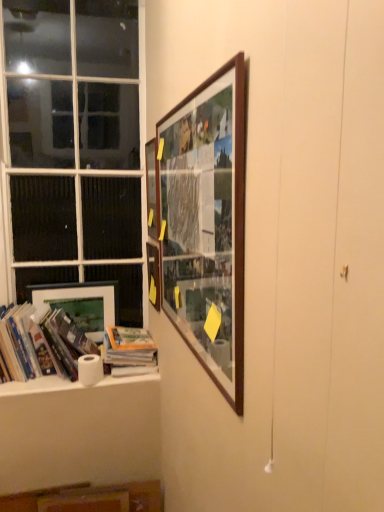
Question: In terms of width, does hardcover book at lower left, which ranks as the second book in left-to-right order, look wider or thinner when compared to hardcover books at left, placed as the first book when sorted from left to right?

Choices:
 (A) thin
 (B) wide

Answer: (B)

Question: Which is correct: hardcover book at lower left, which ranks as the second book in left-to-right order, is inside hardcover books at left, placed as the first book when sorted from left to right, or outside of it?

Choices:
 (A) outside
 (B) inside

Answer: (A)

Question: Based on their relative distances, which object is nearer to the white matte toilet paper at lower left?

Choices:
 (A) wooden picture frame at upper center, which is the 2th picture frame in back-to-front order
 (B) wooden picture frame at upper center, placed as the 1th picture frame when sorted from right to left
 (C) matte wooden picture frame at lower left, marked as the 1th picture frame in a left-to-right arrangement
 (D) wooden frame at upper center, which is the second picture frame from front to back
 (E) hardcover book at lower left, the 1th book positioned from the right

Answer: (E)

Question: Which object is the closest to the wooden picture frame at upper center, which is the 4th picture frame in back-to-front order?

Choices:
 (A) wooden picture frame at upper center, acting as the second picture frame starting from the left
 (B) hardcover book at lower left, the 1th book positioned from the right
 (C) white glass window at left
 (D) white paper towel at lower left
 (E) wooden frame at upper center, which is the second picture frame from front to back

Answer: (E)